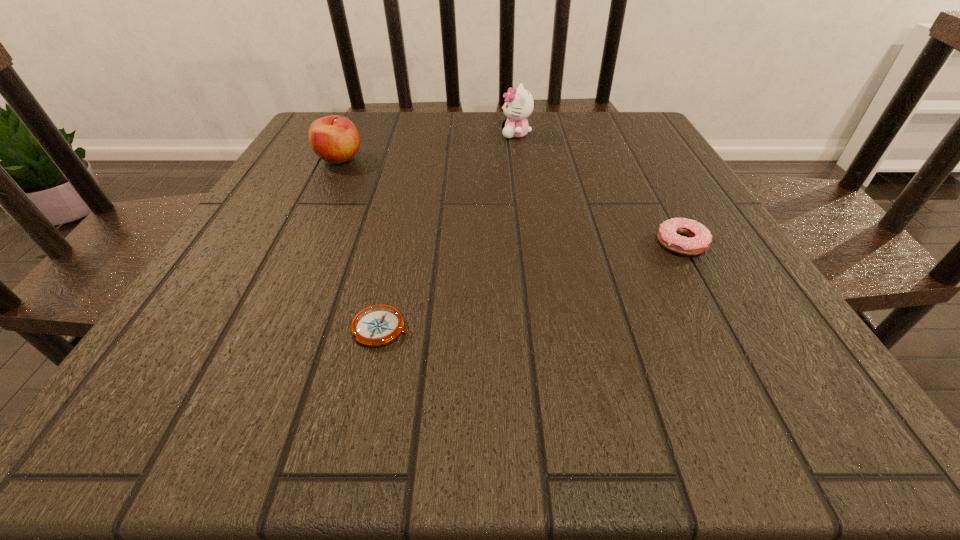
Identify the location of free spot between the second farthest object and the kitten. The height and width of the screenshot is (540, 960). (428, 147).

This screenshot has height=540, width=960. In order to click on blank region between the third farthest object and the nearest object in this screenshot , I will do `click(532, 286)`.

I want to click on empty location between the second farthest object and the shortest object, so click(x=361, y=244).

The height and width of the screenshot is (540, 960). Find the location of `free spot between the rightmost object and the apple`. free spot between the rightmost object and the apple is located at coordinates (511, 201).

Where is `empty location between the kitten and the rightmost object`? empty location between the kitten and the rightmost object is located at coordinates pyautogui.click(x=599, y=189).

Find the location of a particular element. object that is the third closest to the second shortest object is located at coordinates (335, 139).

Locate an element on the screen. object that is the second closest to the rightmost object is located at coordinates (377, 325).

Find the location of a particular element. The width and height of the screenshot is (960, 540). free location that satisfies the following two spatial constraints: 1. on the back side of the second shortest object; 2. on the front-facing side of the third object from left to right is located at coordinates (621, 134).

Locate an element on the screen. vacant position in the image that satisfies the following two spatial constraints: 1. on the back side of the rightmost object; 2. on the front-facing side of the tallest object is located at coordinates (621, 134).

The height and width of the screenshot is (540, 960). What are the coordinates of `free location that satisfies the following two spatial constraints: 1. on the front-facing side of the farthest object; 2. on the right side of the second nearest object` in the screenshot? It's located at (532, 244).